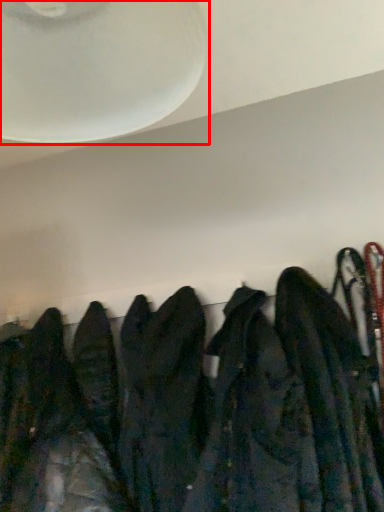
Question: From the image's perspective, where is fan (annotated by the red box) located relative to jacket?

Choices:
 (A) below
 (B) above

Answer: (B)